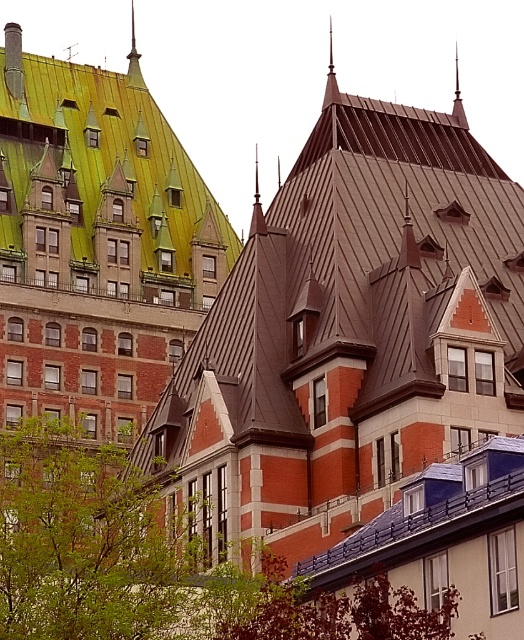
Is point (169, 216) in front of point (133, 65)?

Yes.

Between point (169, 173) and point (135, 70), which one is positioned in front?

Point (169, 173)

Locate an element on the screen. green corrugated metal roof at upper left is located at coordinates (101, 188).

The image size is (524, 640). What are the coordinates of `green corrugated metal roof at upper left` in the screenshot? It's located at (101, 188).

Is green leafy tree at lower left positioned in front of green corrugated metal roof at upper left?

That is True.

Does green leafy tree at lower left lie behind green corrugated metal roof at upper left?

No, it is not.

Between point (31, 579) and point (156, 189), which one is positioned behind?

The point (156, 189) is behind.

In order to click on green leafy tree at lower left in this screenshot , I will do [x=154, y=563].

Who is higher up, green leafy tree at lower left or green corrugated metal spire at upper center?

green corrugated metal spire at upper center

Is green leafy tree at lower left closer to camera compared to green corrugated metal spire at upper center?

Yes, it is in front of green corrugated metal spire at upper center.

Find the location of a particular element. This screenshot has width=524, height=640. green leafy tree at lower left is located at coordinates click(x=154, y=563).